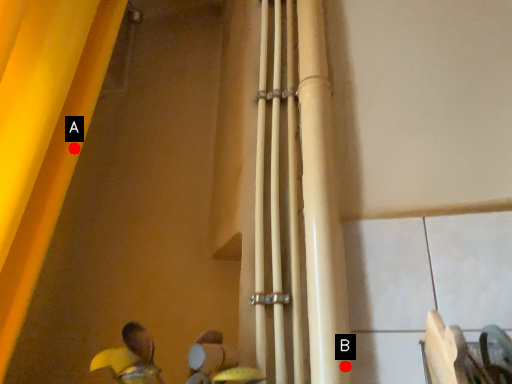
Question: Two points are circled on the image, labeled by A and B beside each circle. Which of the following is the farthest from the observer?

Choices:
 (A) A is further
 (B) B is further

Answer: (A)